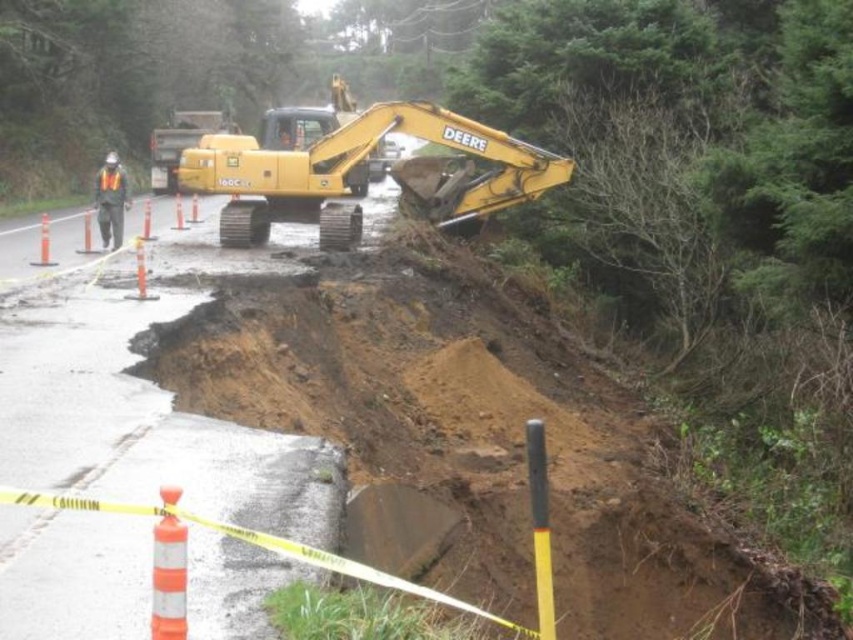
Which is more to the right, yellow rubber excavator at center or orange reflective vest at left?

yellow rubber excavator at center

Is point (531, 188) positioned behind point (102, 237)?

No, it is not.

This screenshot has height=640, width=853. I want to click on yellow rubber excavator at center, so click(357, 170).